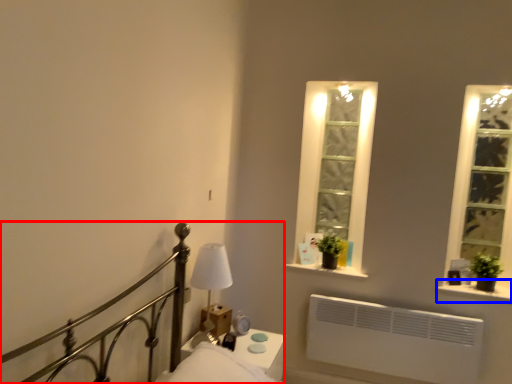
Question: Which object is closer to the camera taking this photo, bed (highlighted by a red box) or window sill (highlighted by a blue box)?

Choices:
 (A) bed
 (B) window sill

Answer: (A)